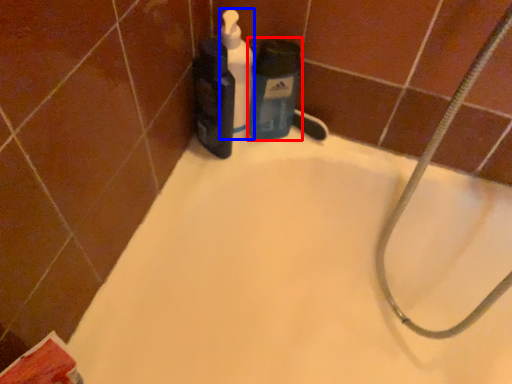
Question: Which point is further to the camera, cleaning product (highlighted by a red box) or cleaning product (highlighted by a blue box)?

Choices:
 (A) cleaning product
 (B) cleaning product

Answer: (A)